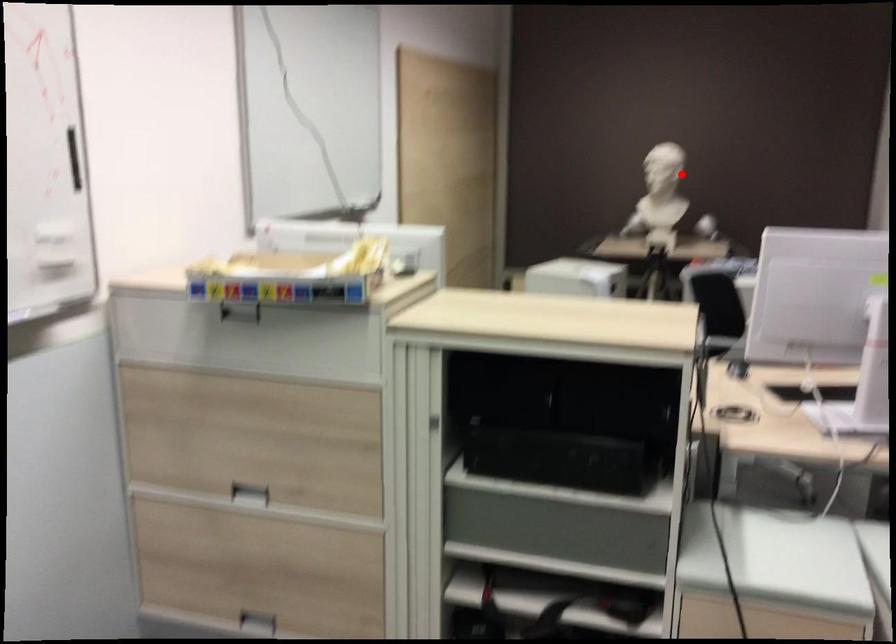
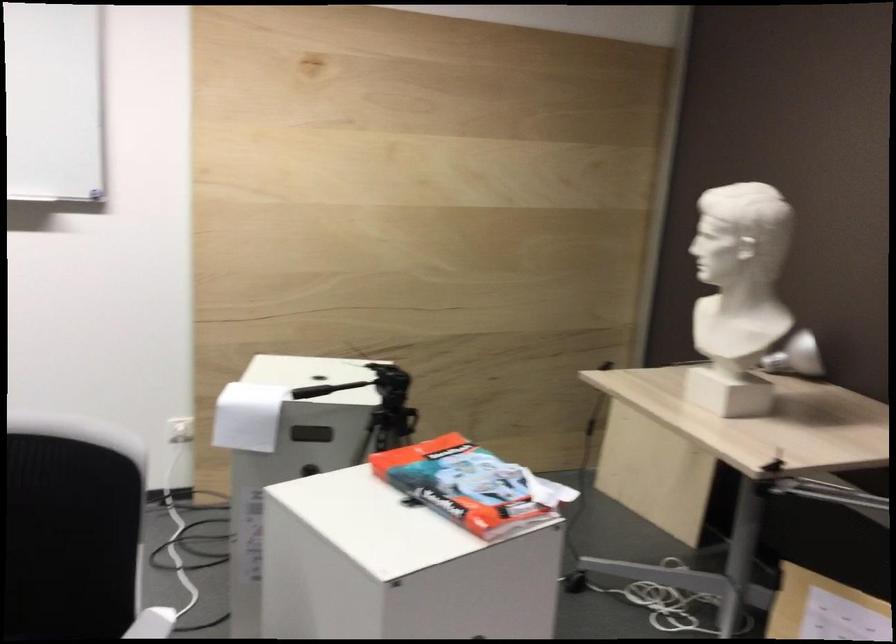
Question: I am providing you with two images of the same scene from different viewpoints. A red point is shown in image1. For the corresponding object point in image2, is it positioned nearer or farther from the camera?

Choices:
 (A) Nearer
 (B) Farther

Answer: (A)